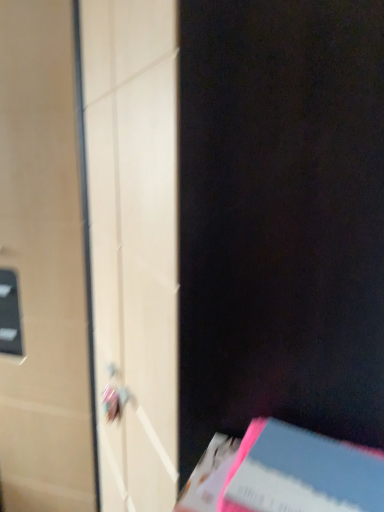
Question: Can you confirm if matte white door at left is positioned to the right of pink matte paper at lower right?

Choices:
 (A) no
 (B) yes

Answer: (A)

Question: Is pink matte paper at lower right a part of matte white door at left?

Choices:
 (A) no
 (B) yes

Answer: (A)

Question: Is matte white door at left wider than pink matte paper at lower right?

Choices:
 (A) yes
 (B) no

Answer: (A)

Question: Can you confirm if matte white door at left is positioned to the left of pink matte paper at lower right?

Choices:
 (A) no
 (B) yes

Answer: (B)

Question: Can you confirm if matte white door at left is taller than pink matte paper at lower right?

Choices:
 (A) no
 (B) yes

Answer: (B)

Question: Is matte white door at left closer to camera compared to pink matte paper at lower right?

Choices:
 (A) yes
 (B) no

Answer: (B)

Question: Is pink matte paper at lower right further to the viewer compared to matte white door at left?

Choices:
 (A) no
 (B) yes

Answer: (A)

Question: Does pink matte paper at lower right appear on the right side of matte white door at left?

Choices:
 (A) no
 (B) yes

Answer: (B)

Question: Does pink matte paper at lower right have a larger size compared to matte white door at left?

Choices:
 (A) yes
 (B) no

Answer: (B)

Question: Is pink matte paper at lower right completely or partially outside of matte white door at left?

Choices:
 (A) no
 (B) yes

Answer: (B)

Question: Is pink matte paper at lower right positioned in front of matte white door at left?

Choices:
 (A) no
 (B) yes

Answer: (B)

Question: From the image's perspective, is pink matte paper at lower right on matte white door at left?

Choices:
 (A) yes
 (B) no

Answer: (B)

Question: Choose the correct answer: Is pink matte paper at lower right inside matte white door at left or outside it?

Choices:
 (A) inside
 (B) outside

Answer: (B)